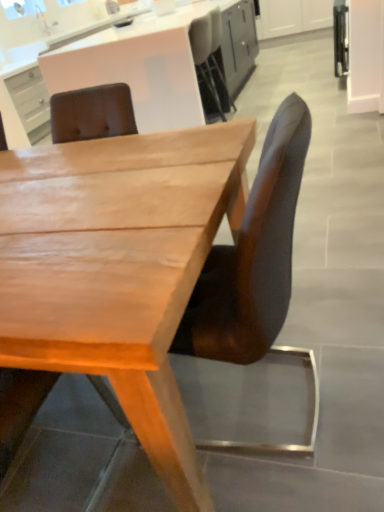
Question: From the image's perspective, is wooden chair at center, the 1th chair viewed from the left, positioned above or below light brown wood desk at center?

Choices:
 (A) below
 (B) above

Answer: (A)

Question: Considering the positions of wooden chair at center, acting as the 2th chair starting from the right, and light brown wood desk at center in the image, is wooden chair at center, acting as the 2th chair starting from the right, wider or thinner than light brown wood desk at center?

Choices:
 (A) thin
 (B) wide

Answer: (A)

Question: Estimate the real-world distances between objects in this image. Which object is closer to the brown leather chair at center, arranged as the first chair when viewed from the right?

Choices:
 (A) wooden chair at center, the 1th chair viewed from the left
 (B) matte white cabinet at upper center
 (C) silver metallic faucet at upper left
 (D) light brown wood desk at center

Answer: (D)

Question: Which object is positioned closest to the light brown wood desk at center?

Choices:
 (A) silver metallic faucet at upper left
 (B) wooden chair at center, acting as the 2th chair starting from the right
 (C) matte white cabinet at upper center
 (D) brown leather chair at center, arranged as the first chair when viewed from the right

Answer: (D)